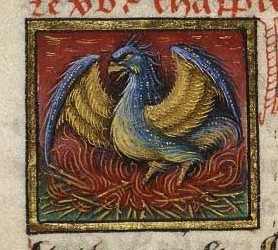
This screenshot has height=250, width=278. I want to click on top right gold corner of framed bird picture, so click(250, 23).